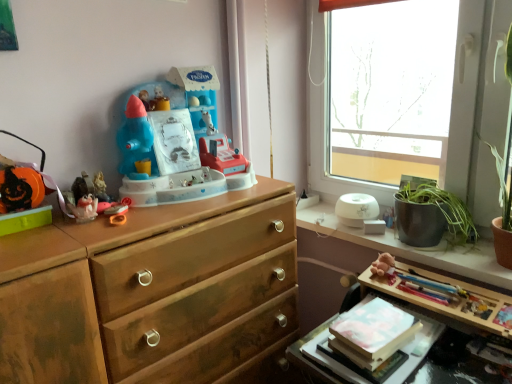
The image size is (512, 384). In order to click on white glossy humidifier at upper right in this screenshot , I will do `click(410, 246)`.

Identify the location of orange matte pumpkin at left, the fourth toy viewed from the right. (22, 197).

The height and width of the screenshot is (384, 512). Find the location of `green leafy plant at window sill`. green leafy plant at window sill is located at coordinates (432, 216).

The height and width of the screenshot is (384, 512). In order to click on transparent glass window at upper right in this screenshot , I will do `click(463, 100)`.

The width and height of the screenshot is (512, 384). Describe the element at coordinates (463, 100) in the screenshot. I see `transparent glass window at upper right` at that location.

In order to click on brown plush toy at upper right in this screenshot , I will do `click(383, 265)`.

In the scene shown: From their relative heights in the image, would you say matte plastic figurine at left, which is the third toy in left-to-right order, is taller or shorter than wooden table at lower right?

In the image, matte plastic figurine at left, which is the third toy in left-to-right order, appears to be shorter than wooden table at lower right.

In the scene shown: Does matte plastic figurine at left, which is the third toy in left-to-right order, have a lesser width compared to wooden table at lower right?

Correct, the width of matte plastic figurine at left, which is the third toy in left-to-right order, is less than that of wooden table at lower right.

How different are the orientations of matte plastic figurine at left, which is the third toy in left-to-right order, and wooden table at lower right in degrees?

matte plastic figurine at left, which is the third toy in left-to-right order, and wooden table at lower right are facing 94.2 degrees away from each other.

Looking at this image, from a real-world perspective, who is located lower, matte plastic figurine at left, which is the third toy in left-to-right order, or wooden table at lower right?

wooden table at lower right, from a real-world perspective.

Looking at this image, considering the sizes of objects orange matte pumpkin at left, the fourth toy viewed from the right, and matte plastic toy at left, which is the 3th toy from right to left, in the image provided, who is wider, orange matte pumpkin at left, the fourth toy viewed from the right, or matte plastic toy at left, which is the 3th toy from right to left,?

Wider between the two is orange matte pumpkin at left, the fourth toy viewed from the right.

In the scene shown: Which object is closer to the camera, orange matte pumpkin at left, the fourth toy viewed from the right, or matte plastic toy at left, which is the 3th toy from right to left?

orange matte pumpkin at left, the fourth toy viewed from the right.

Is orange matte pumpkin at left, positioned as the 1th toy in left-to-right order, turned away from plastic toy at center, which is the first toy in right-to-left order?

No, orange matte pumpkin at left, positioned as the 1th toy in left-to-right order,'s orientation is not away from plastic toy at center, which is the first toy in right-to-left order.

Where is `toy that is the 3rd one when counting leftward from the plastic toy at center, acting as the fourth toy starting from the left`? toy that is the 3rd one when counting leftward from the plastic toy at center, acting as the fourth toy starting from the left is located at coordinates (22, 197).

From the image's perspective, who appears lower, orange matte pumpkin at left, the fourth toy viewed from the right, or plastic toy at center, acting as the fourth toy starting from the left?

orange matte pumpkin at left, the fourth toy viewed from the right, from the image's perspective.

Does orange matte pumpkin at left, the fourth toy viewed from the right, appear on the left side of plastic toy at center, which is the first toy in right-to-left order?

Yes.

The height and width of the screenshot is (384, 512). Find the location of `window that appears above the white matte book at lower right (from the image's perspective)`. window that appears above the white matte book at lower right (from the image's perspective) is located at coordinates (463, 100).

Is white matte book at lower right facing towards transparent glass window at upper right?

No, white matte book at lower right is not facing towards transparent glass window at upper right.

Is white matte book at lower right closer to the viewer compared to transparent glass window at upper right?

Yes, white matte book at lower right is in front of transparent glass window at upper right.

Is there a large distance between white matte book at lower right and transparent glass window at upper right?

Actually, white matte book at lower right and transparent glass window at upper right are a little close together.

Does green leafy plant at window sill have a smaller size compared to matte plastic toy at left, acting as the second toy starting from the left?

Actually, green leafy plant at window sill might be larger than matte plastic toy at left, acting as the second toy starting from the left.

Is the depth of green leafy plant at window sill less than that of matte plastic toy at left, acting as the second toy starting from the left?

That is False.

Could you tell me if green leafy plant at window sill is turned towards matte plastic toy at left, which is the 3th toy from right to left?

Yes, green leafy plant at window sill is oriented towards matte plastic toy at left, which is the 3th toy from right to left.

Based on the photo, does matte plastic toy at left, which is the 3th toy from right to left, turn towards matte plastic figurine at left, acting as the 2th toy starting from the right?

No, matte plastic toy at left, which is the 3th toy from right to left, is not oriented towards matte plastic figurine at left, acting as the 2th toy starting from the right.

Could matte plastic figurine at left, acting as the 2th toy starting from the right, be considered to be inside matte plastic toy at left, acting as the second toy starting from the left?

Definitely not — matte plastic figurine at left, acting as the 2th toy starting from the right, is not inside matte plastic toy at left, acting as the second toy starting from the left.

Based on their sizes in the image, would you say matte plastic toy at left, which is the 3th toy from right to left, is bigger or smaller than matte plastic figurine at left, which is the third toy in left-to-right order?

Considering their sizes, matte plastic toy at left, which is the 3th toy from right to left, takes up more space than matte plastic figurine at left, which is the third toy in left-to-right order.

From the image's perspective, is matte plastic toy at left, which is the 3th toy from right to left, below matte plastic figurine at left, which is the third toy in left-to-right order?

Yes, from the image's perspective, matte plastic toy at left, which is the 3th toy from right to left, is below matte plastic figurine at left, which is the third toy in left-to-right order.

Is point (408, 217) closer to viewer compared to point (104, 198)?

No, (408, 217) is further to viewer.

Considering the sizes of objects green leafy plant at window sill and matte plastic figurine at left, acting as the 2th toy starting from the right, in the image provided, who is bigger, green leafy plant at window sill or matte plastic figurine at left, acting as the 2th toy starting from the right,?

green leafy plant at window sill.

Can you see green leafy plant at window sill touching matte plastic figurine at left, acting as the 2th toy starting from the right?

They are not placed beside each other.

What's the angular difference between green leafy plant at window sill and matte plastic figurine at left, acting as the 2th toy starting from the right,'s facing directions?

green leafy plant at window sill and matte plastic figurine at left, acting as the 2th toy starting from the right, are facing 96.5 degrees away from each other.

Locate an element on the screen. The width and height of the screenshot is (512, 384). table below the matte plastic figurine at left, which is the third toy in left-to-right order (from the image's perspective) is located at coordinates (452, 301).

Identify the location of the 2nd toy behind the orange matte pumpkin at left, the fourth toy viewed from the right, starting your count from the anchor. The width and height of the screenshot is (512, 384). (84, 208).

Looking at the image, which one is located further to green leafy plant at window sill, transparent glass window at upper right or wooden table at lower right?

Based on the image, transparent glass window at upper right appears to be further to green leafy plant at window sill.

Considering their positions, is white matte book at lower right positioned further to matte plastic figurine at left, which is the third toy in left-to-right order, than white glossy humidifier at upper right?

white glossy humidifier at upper right.

Considering their positions, is transparent glass window at upper right positioned further to orange matte pumpkin at left, positioned as the 1th toy in left-to-right order, than white glossy humidifier at upper right?

Based on the image, transparent glass window at upper right appears to be further to orange matte pumpkin at left, positioned as the 1th toy in left-to-right order.

When comparing their distances from matte plastic toy at left, which is the 3th toy from right to left, does green leafy plant at window sill or white matte book at lower right seem further?

green leafy plant at window sill is positioned further to the anchor matte plastic toy at left, which is the 3th toy from right to left.

In the scene shown: Looking at the image, which one is located closer to transparent glass window at upper right, matte plastic figurine at left, acting as the 2th toy starting from the right, or green leafy plant at window sill?

green leafy plant at window sill.

In the scene shown: When comparing their distances from white glossy humidifier at upper right, does wooden knob at center or white matte book at lower right seem further?

Based on the image, wooden knob at center appears to be further to white glossy humidifier at upper right.

Considering their positions, is green leafy plant at window sill positioned closer to matte plastic toy at left, acting as the second toy starting from the left, than orange matte pumpkin at left, positioned as the 1th toy in left-to-right order?

Among the two, orange matte pumpkin at left, positioned as the 1th toy in left-to-right order, is located nearer to matte plastic toy at left, acting as the second toy starting from the left.

Considering their positions, is orange matte pumpkin at left, the fourth toy viewed from the right, positioned closer to brown plush toy at upper right than matte plastic toy at left, which is the 3th toy from right to left?

matte plastic toy at left, which is the 3th toy from right to left, lies closer to brown plush toy at upper right than the other object.

Where is `counter between transparent glass window at upper right and white matte book at lower right from top to bottom`? Image resolution: width=512 pixels, height=384 pixels. counter between transparent glass window at upper right and white matte book at lower right from top to bottom is located at coordinates (410, 246).

At what (x,y) coordinates should I click in order to perform the action: click on counter between orange matte pumpkin at left, the fourth toy viewed from the right, and wooden table at lower right. Please return your answer as a coordinate pair (x, y). This screenshot has width=512, height=384. Looking at the image, I should click on (410, 246).

At what (x,y) coordinates should I click in order to perform the action: click on counter located between matte plastic toy at left, acting as the second toy starting from the left, and wooden table at lower right in the left-right direction. Please return your answer as a coordinate pair (x, y). The width and height of the screenshot is (512, 384). Looking at the image, I should click on (410, 246).

Find the location of a particular element. book located between wooden knob at center and white glossy humidifier at upper right in the left-right direction is located at coordinates (372, 332).